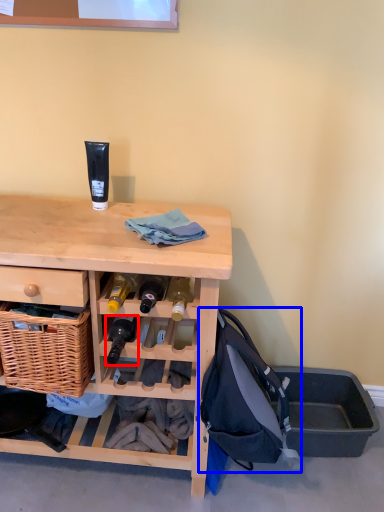
Question: Which object appears farthest to the camera in this image, bottle (highlighted by a red box) or backpack (highlighted by a blue box)?

Choices:
 (A) bottle
 (B) backpack

Answer: (A)